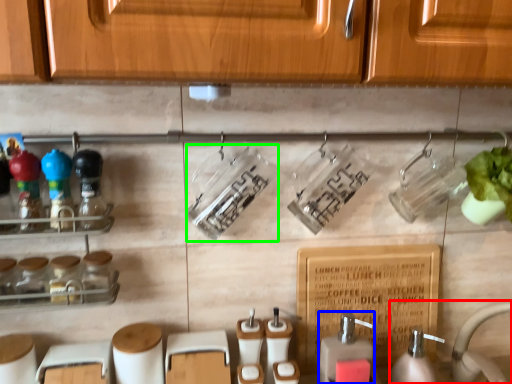
Question: Considering the real-world distances, which object is closest to sink (highlighted by a red box)? soap dispenser (highlighted by a blue box) or bottle (highlighted by a green box).

Choices:
 (A) soap dispenser
 (B) bottle

Answer: (A)